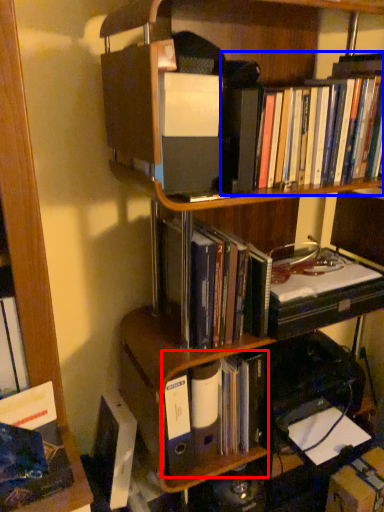
Question: Which object is closer to the camera taking this photo, book (highlighted by a red box) or book (highlighted by a blue box)?

Choices:
 (A) book
 (B) book

Answer: (B)